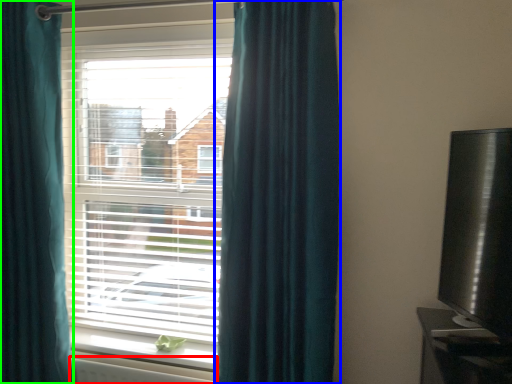
Question: Estimate the real-world distances between objects in this image. Which object is farther from radiator (highlighted by a red box), curtain (highlighted by a blue box) or curtain (highlighted by a green box)?

Choices:
 (A) curtain
 (B) curtain

Answer: (A)